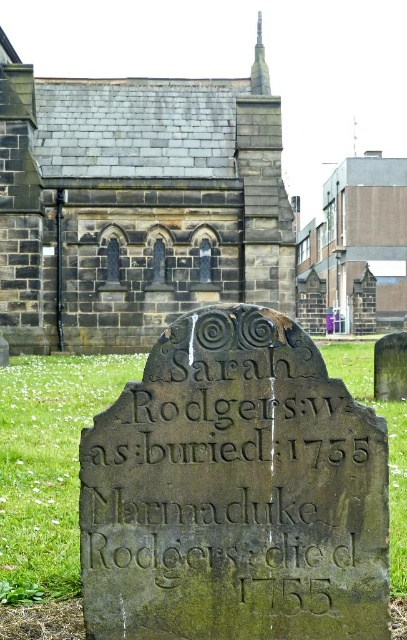
Question: Does green grass at center come behind smooth gray stone spire at upper center?

Choices:
 (A) yes
 (B) no

Answer: (B)

Question: Which object is the closest to the brown stone church at upper center?

Choices:
 (A) smooth gray stone spire at upper center
 (B) green grass at center

Answer: (A)

Question: Does dark gray stone church at upper center lie behind green grass at center?

Choices:
 (A) no
 (B) yes

Answer: (B)

Question: Which point is farther to the camera?

Choices:
 (A) dark gray stone church at upper center
 (B) green grass at center

Answer: (A)

Question: Which point is closer to the camera?

Choices:
 (A) smooth gray stone spire at upper center
 (B) green grass at center

Answer: (B)

Question: Observing the image, what is the correct spatial positioning of dark gray stone church at upper center in reference to green grass at center?

Choices:
 (A) right
 (B) left

Answer: (B)